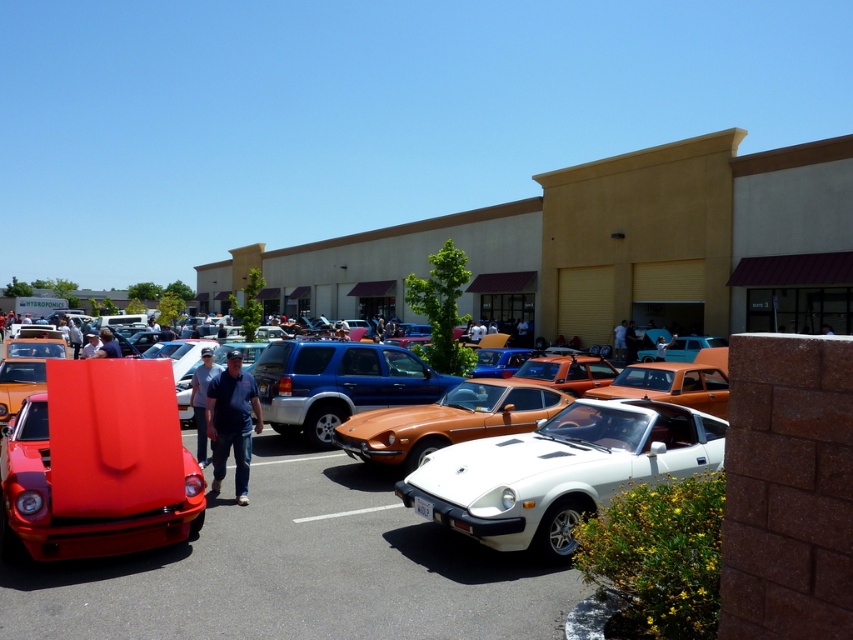
You are a photographer setting up a camera on a tripod. You want to capture both the shiny orange car at center and the white matte convertible at center in a single shot. Given that your camera has a fixed focal length, which car should you position closer to the camera to ensure both fit in the frame?

Since the shiny orange car at center is narrower than the white matte convertible at center, you should position the wider white matte convertible at center closer to the camera. This way, both cars will fit within the frame while maintaining their proportions.